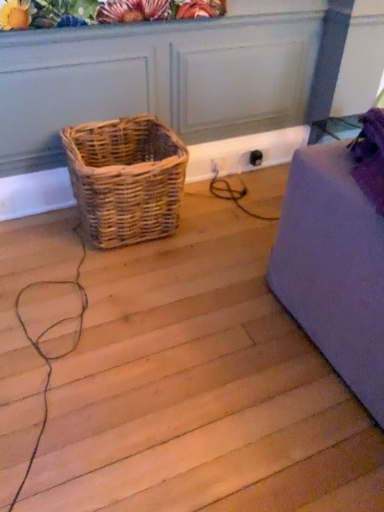
Question: Is matte floral arrangement at upper center aimed at woven natural basket at center-left?

Choices:
 (A) no
 (B) yes

Answer: (A)

Question: Is woven natural basket at center-left located within matte floral arrangement at upper center?

Choices:
 (A) no
 (B) yes

Answer: (A)

Question: Can you confirm if matte floral arrangement at upper center is positioned to the left of woven natural basket at center-left?

Choices:
 (A) yes
 (B) no

Answer: (B)

Question: Is matte floral arrangement at upper center positioned with its back to woven natural basket at center-left?

Choices:
 (A) no
 (B) yes

Answer: (A)

Question: Is matte floral arrangement at upper center not near woven natural basket at center-left?

Choices:
 (A) yes
 (B) no

Answer: (B)

Question: From a real-world perspective, is matte floral arrangement at upper center on top of woven natural basket at center-left?

Choices:
 (A) yes
 (B) no

Answer: (A)

Question: From the image's perspective, is woven natural basket at center-left on top of matte floral arrangement at upper center?

Choices:
 (A) yes
 (B) no

Answer: (B)

Question: Does woven natural basket at center-left lie in front of matte floral arrangement at upper center?

Choices:
 (A) yes
 (B) no

Answer: (B)

Question: Can you confirm if woven natural basket at center-left is wider than matte floral arrangement at upper center?

Choices:
 (A) yes
 (B) no

Answer: (A)

Question: Can you confirm if woven natural basket at center-left is shorter than matte floral arrangement at upper center?

Choices:
 (A) no
 (B) yes

Answer: (A)

Question: Does woven natural basket at center-left have a smaller size compared to matte floral arrangement at upper center?

Choices:
 (A) yes
 (B) no

Answer: (B)

Question: From a real-world perspective, is woven natural basket at center-left beneath matte floral arrangement at upper center?

Choices:
 (A) yes
 (B) no

Answer: (A)

Question: From a real-world perspective, is matte floral arrangement at upper center physically located above or below woven natural basket at center-left?

Choices:
 (A) below
 (B) above

Answer: (B)